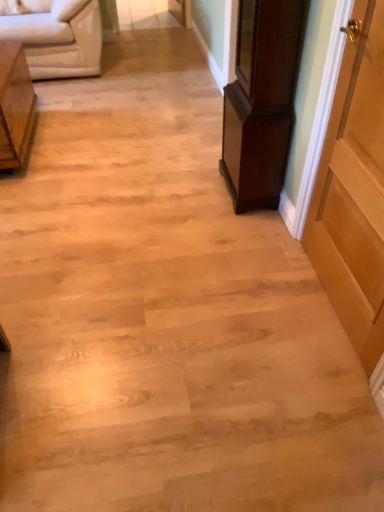
This screenshot has height=512, width=384. In order to click on vacant space that is to the left of dark wood cabinet at right, which ranks as the 2th furniture in left-to-right order in this screenshot , I will do `click(188, 194)`.